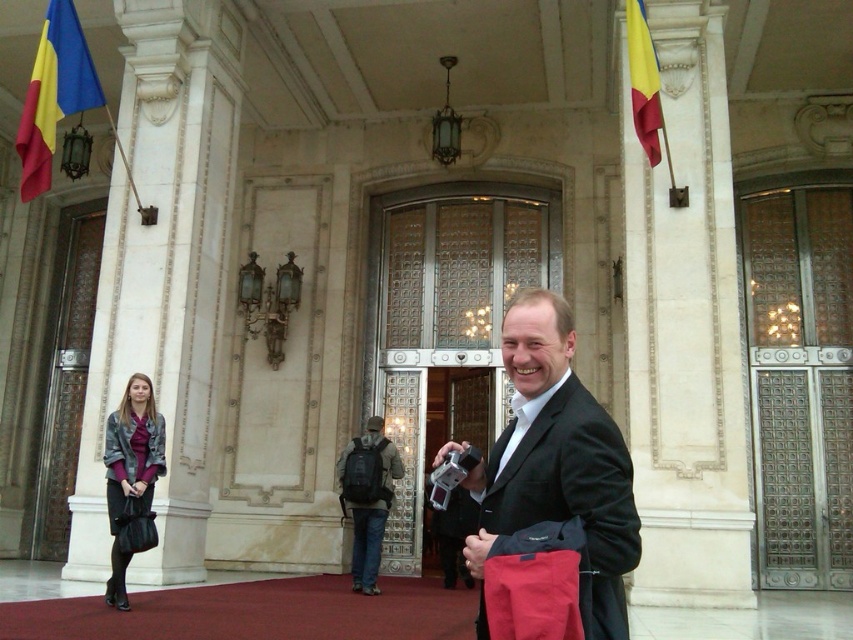
Question: Is polyester flag at upper right further to camera compared to matte black backpack at center?

Choices:
 (A) yes
 (B) no

Answer: (B)

Question: Can you confirm if black matte suit at center is smaller than matte black backpack at center?

Choices:
 (A) yes
 (B) no

Answer: (B)

Question: Which object is farther from the camera taking this photo?

Choices:
 (A) black matte suit at center
 (B) matte black backpack at center

Answer: (B)

Question: Considering the real-world distances, which object is closest to the matte black backpack at center?

Choices:
 (A) blue fabric flag at upper left
 (B) polyester flag at upper right
 (C) dark gray backpack at center

Answer: (C)

Question: Can you confirm if black matte suit at center is positioned to the right of dark gray backpack at center?

Choices:
 (A) yes
 (B) no

Answer: (A)

Question: Which object is positioned closest to the blue fabric flag at upper left?

Choices:
 (A) matte black backpack at center
 (B) polyester flag at upper right
 (C) black matte suit at center

Answer: (A)